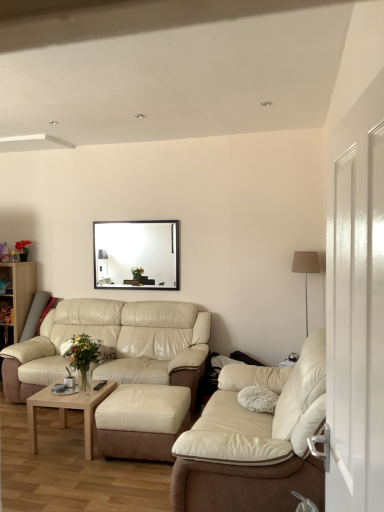
Question: From a real-world perspective, is silver metallic floor lamp at right above or below suede ottoman at center?

Choices:
 (A) below
 (B) above

Answer: (B)

Question: Is point (302, 271) closer or farther from the camera than point (160, 422)?

Choices:
 (A) closer
 (B) farther

Answer: (B)

Question: Estimate the real-world distances between objects in this image. Which object is farther from the beige leather couch at lower left, positioned as the 2th studio couch in front-to-back order?

Choices:
 (A) beige leather couch at center, which is the 1th studio couch from front to back
 (B) white glossy door at right
 (C) black glossy picture frame at upper center
 (D) light brown wooden coffee table at lower left
 (E) suede ottoman at center

Answer: (B)

Question: Which object is positioned closest to the beige leather couch at lower left, the first studio couch positioned from the back?

Choices:
 (A) light brown wooden coffee table at lower left
 (B) beige leather couch at center, which is the 1th studio couch from front to back
 (C) wooden bookshelf at left
 (D) white glossy door at right
 (E) suede ottoman at center

Answer: (E)